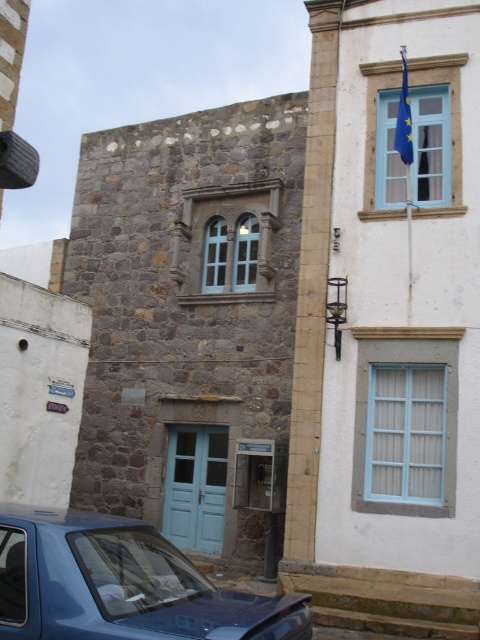
You are a photographer planning to capture both the metallic blue car at lower left and the blue fabric flag at upper right in a single frame. Based on their sizes, which object should appear smaller in your photo?

The metallic blue car at lower left should appear smaller in the photo because it is not as tall as the blue fabric flag at upper right.

You are a delivery person trying to park your metallic blue car at lower left. There is a blue fabric flag at upper right that you must not hit. Can you estimate if the car will fit without hitting the flag?

The metallic blue car at lower left might be wider than blue fabric flag at upper right, so there is a risk of collision. Please adjust your parking angle or choose a different spot.

You are a pedestrian standing on the sidewalk and see the metallic blue car at lower left and the blue fabric flag at upper right. Which object is closer to the left edge of the street?

The metallic blue car at lower left is positioned on the left side of the blue fabric flag at upper right, so it is closer to the left edge of the street.